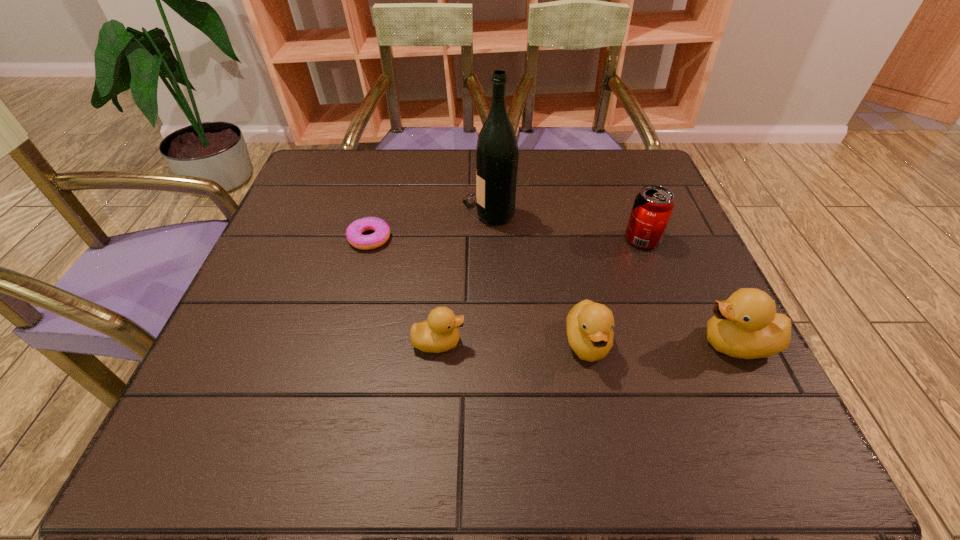
The height and width of the screenshot is (540, 960). I want to click on vacant point located 0.050m on the face of the second tallest duckling, so click(x=598, y=398).

You are a GUI agent. You are given a task and a screenshot of the screen. Output one action in this format:
    pyautogui.click(x=<x>, y=<y>)
    Task: Click on the vacant space located 0.170m on the face of the tallest duckling
    This screenshot has height=540, width=960.
    Given the screenshot: What is the action you would take?
    pyautogui.click(x=604, y=343)

At what (x,y) coordinates should I click in order to perform the action: click on free location located on the face of the tallest duckling. Please return your answer as a coordinate pair (x, y). The image size is (960, 540). Looking at the image, I should click on (647, 343).

Where is `vacant space located on the face of the tallest duckling`? vacant space located on the face of the tallest duckling is located at coordinates (556, 343).

The image size is (960, 540). Find the location of `vacant space located 0.190m on the front of the shortest object`. vacant space located 0.190m on the front of the shortest object is located at coordinates click(x=348, y=319).

What are the coordinates of `vacant space located 0.190m on the front of the soda can` in the screenshot? It's located at (672, 317).

In order to click on vacant space located on the right of the wine bottle in this screenshot , I will do `click(542, 212)`.

I want to click on object situated at the far edge, so click(x=497, y=154).

In order to click on duckling that is at the right edge in this screenshot , I will do `click(746, 325)`.

At what (x,y) coordinates should I click in order to perform the action: click on soda can present at the right edge. Please return your answer as a coordinate pair (x, y). Looking at the image, I should click on (653, 205).